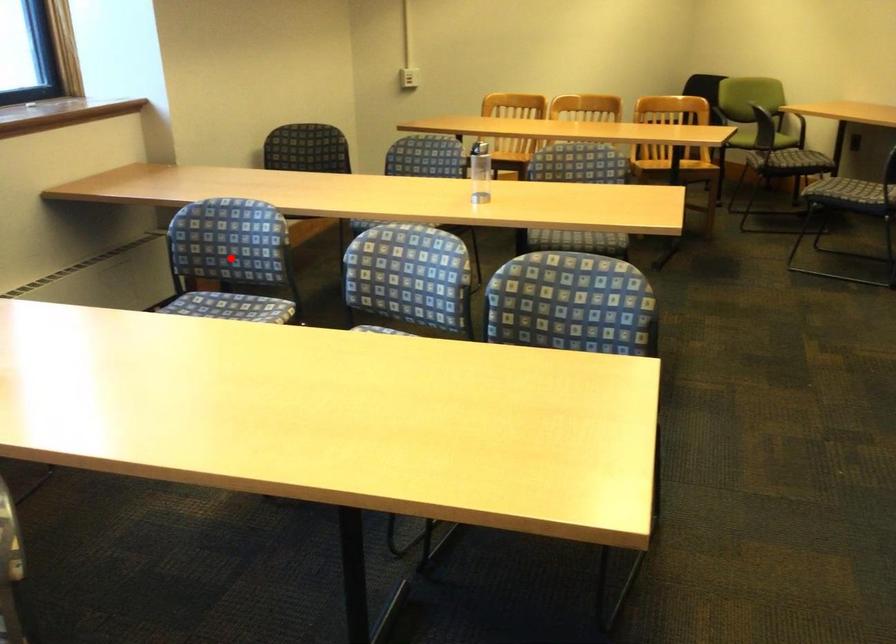
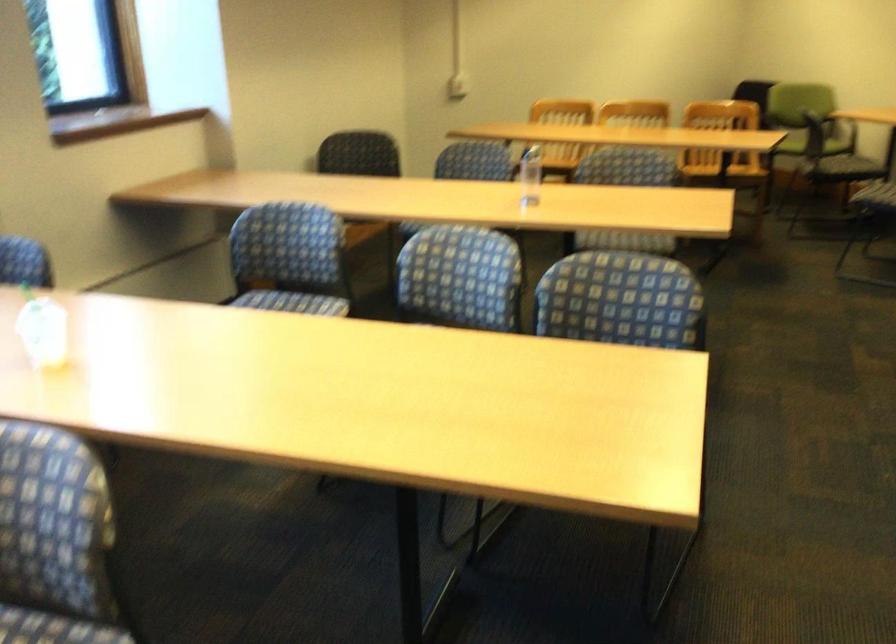
Locate, in the second image, the point that corresponds to the highlighted location in the first image.

(289, 259)